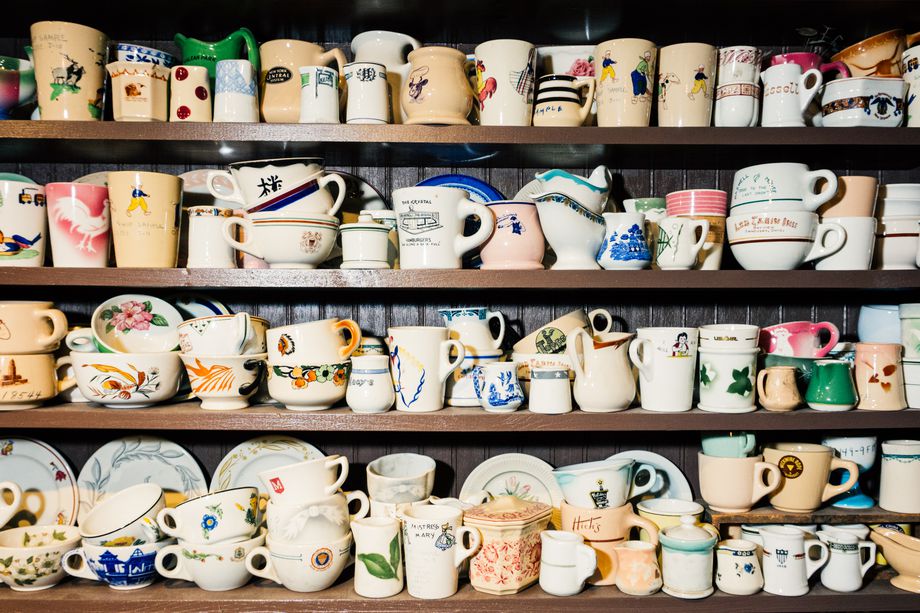
At what (x,y) coordinates should I click in order to perform the action: click on long wooden shelves. Please return your answer as a coordinate pair (x, y). The image size is (920, 613). Looking at the image, I should click on (426, 419), (343, 602), (431, 278), (406, 140).